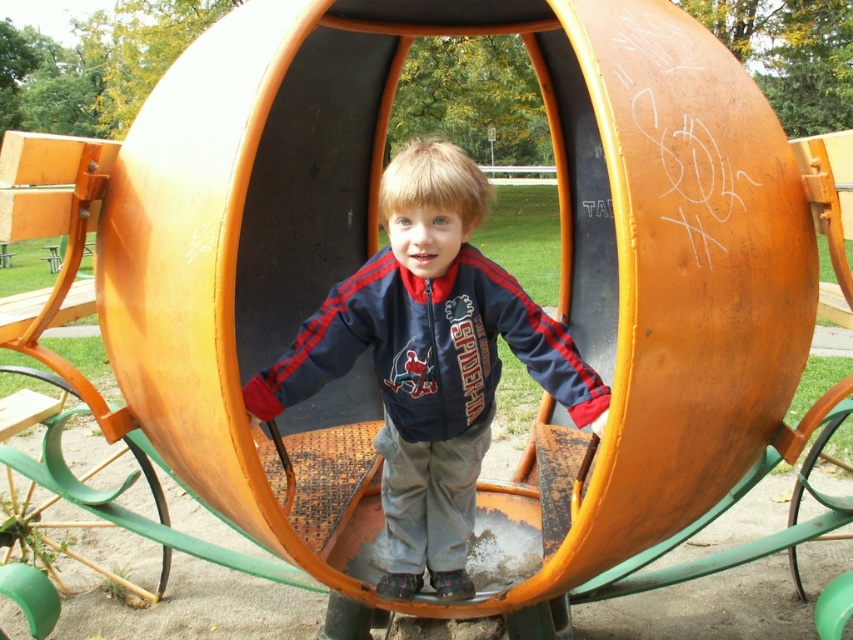
Who is positioned more to the left, matte orange swing at center or navy blue fleece sweatshirt at center?

Positioned to the left is navy blue fleece sweatshirt at center.

Does point (378, 330) come in front of point (456, 433)?

Yes, point (378, 330) is in front of point (456, 433).

Find the location of a particular element. The image size is (853, 640). matte orange swing at center is located at coordinates (430, 360).